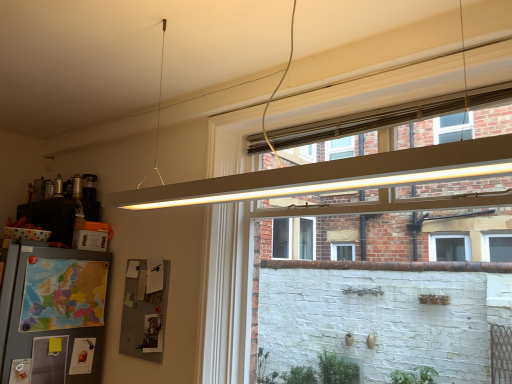
Question: Is matte white frame at upper center in front of or behind gray fabric bulletin board at lower left in the image?

Choices:
 (A) front
 (B) behind

Answer: (A)

Question: Is matte white frame at upper center taller or shorter than gray fabric bulletin board at lower left?

Choices:
 (A) short
 (B) tall

Answer: (B)

Question: Would you say matte white frame at upper center is to the left or to the right of gray fabric bulletin board at lower left in the picture?

Choices:
 (A) left
 (B) right

Answer: (B)

Question: In terms of width, does gray fabric bulletin board at lower left look wider or thinner when compared to matte white frame at upper center?

Choices:
 (A) thin
 (B) wide

Answer: (A)

Question: Is point (144, 357) positioned closer to the camera than point (239, 264)?

Choices:
 (A) farther
 (B) closer

Answer: (A)

Question: In terms of size, does gray fabric bulletin board at lower left appear bigger or smaller than matte white frame at upper center?

Choices:
 (A) big
 (B) small

Answer: (B)

Question: From the image's perspective, relative to matte white frame at upper center, is gray fabric bulletin board at lower left above or below?

Choices:
 (A) above
 (B) below

Answer: (B)